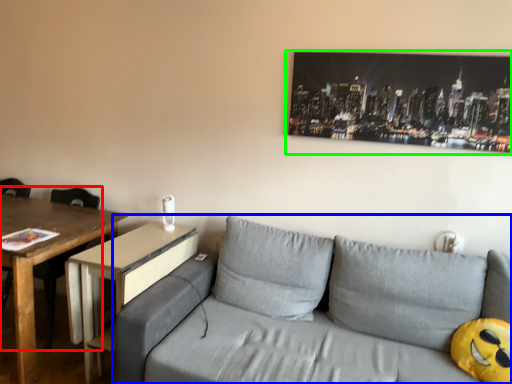
Question: Considering the real-world distances, which object is closest to chair (highlighted by a red box)? studio couch (highlighted by a blue box) or picture frame (highlighted by a green box).

Choices:
 (A) studio couch
 (B) picture frame

Answer: (A)